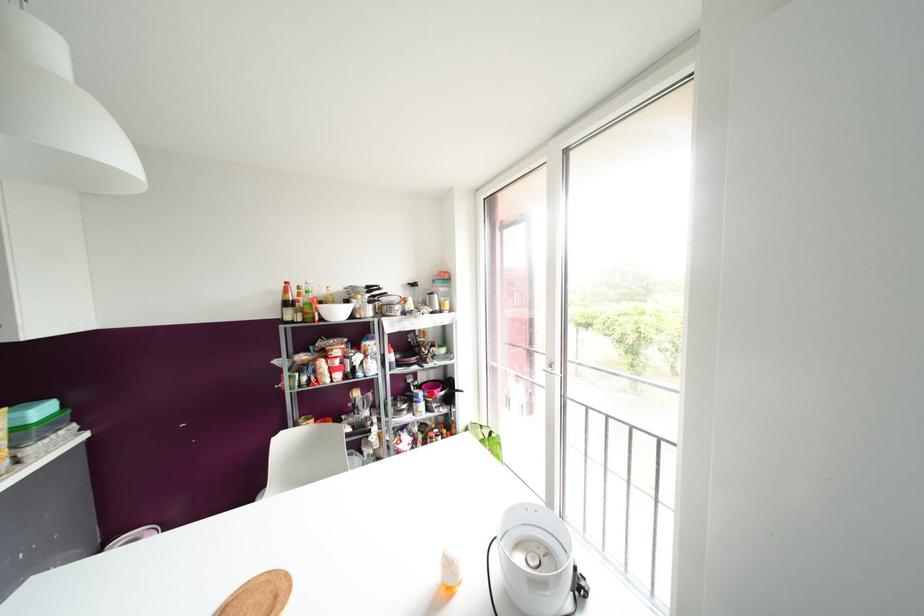
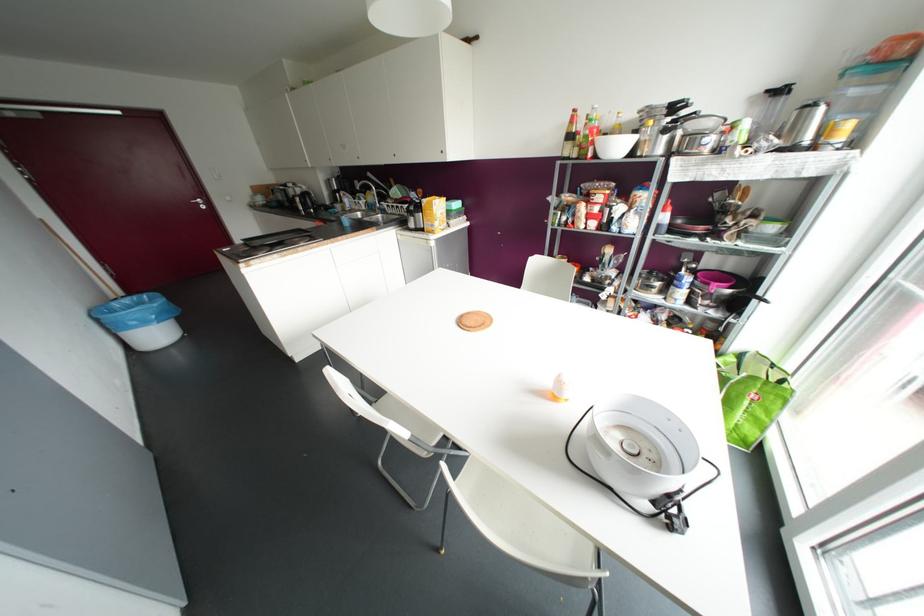
Find the pixel in the second image that matches the highlighted location in the first image.

(703, 286)